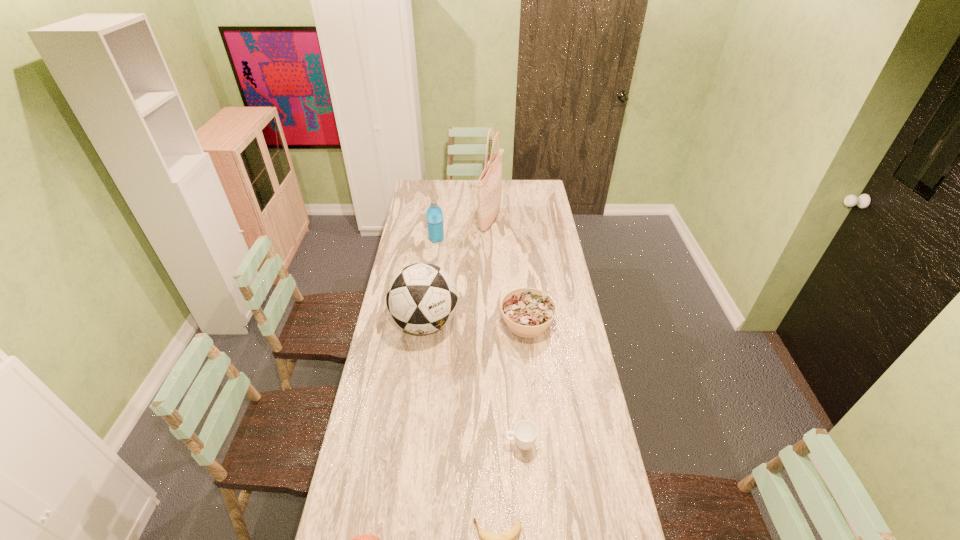
The width and height of the screenshot is (960, 540). Identify the location of the seventh closest object relative to the tallest object. (364, 539).

At what (x,y) coordinates should I click in order to perform the action: click on vacant region that satisfies the following two spatial constraints: 1. on the surface of the fourth shortest object; 2. on the left side of the farthest object. Please return your answer as a coordinate pair (x, y). The height and width of the screenshot is (540, 960). Looking at the image, I should click on (494, 322).

Where is `vacant region that satisfies the following two spatial constraints: 1. on the surface of the farthest object; 2. on the surface of the soccer ball where the brand logo is visible`? vacant region that satisfies the following two spatial constraints: 1. on the surface of the farthest object; 2. on the surface of the soccer ball where the brand logo is visible is located at coordinates (494, 323).